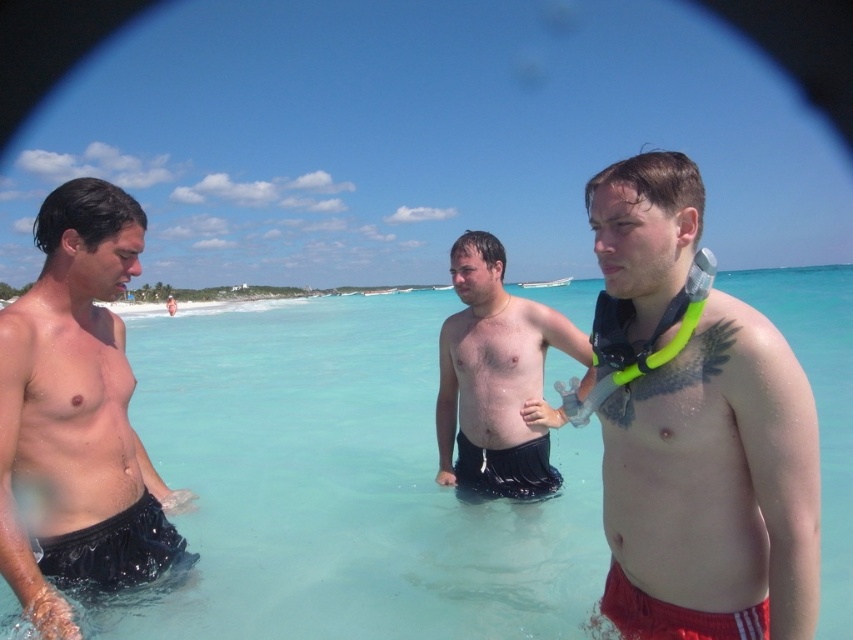
Question: Does shiny black shorts at left have a greater width compared to smooth black shorts at center?

Choices:
 (A) yes
 (B) no

Answer: (B)

Question: Is matte black snorkel at center above red fabric shorts at lower right?

Choices:
 (A) no
 (B) yes

Answer: (B)

Question: Which object is positioned closest to the smooth black shorts at center?

Choices:
 (A) shiny black shorts at left
 (B) red fabric shorts at lower right
 (C) matte black snorkel at center
 (D) black mesh shorts at lower left

Answer: (C)

Question: Which point is closer to the camera?

Choices:
 (A) shiny black shorts at left
 (B) matte black snorkel at center
 (C) red fabric shorts at lower right

Answer: (B)

Question: Among these objects, which one is nearest to the camera?

Choices:
 (A) smooth black shorts at center
 (B) red fabric shorts at lower right
 (C) shiny black shorts at left

Answer: (B)

Question: Considering the relative positions of shiny black shorts at left and smooth black shorts at center in the image provided, where is shiny black shorts at left located with respect to smooth black shorts at center?

Choices:
 (A) below
 (B) above

Answer: (B)